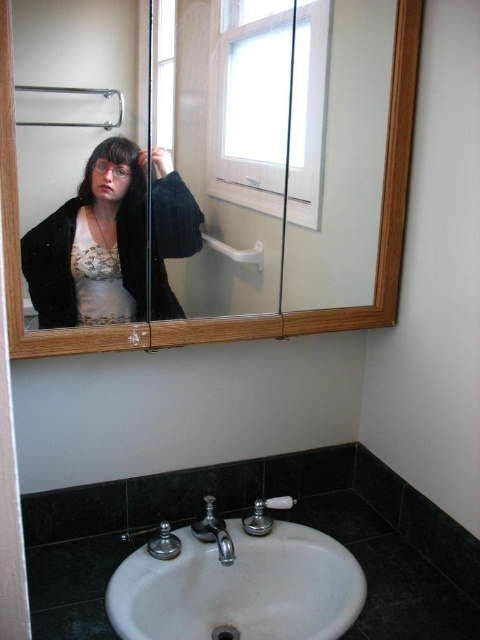
Question: Does white glossy sink at lower center have a greater width compared to silver metallic faucet at lower center?

Choices:
 (A) yes
 (B) no

Answer: (A)

Question: Is white glossy sink at lower center wider than satin nickel faucet at sink center?

Choices:
 (A) no
 (B) yes

Answer: (B)

Question: Which point is closer to the camera taking this photo?

Choices:
 (A) (132, 260)
 (B) (215, 570)

Answer: (A)

Question: Which object is positioned closest to the matte black sweater at upper left?

Choices:
 (A) wooden cabinet at upper center
 (B) satin nickel faucet at sink center
 (C) white glossy sink at lower center
 (D) silver metallic faucet at lower center

Answer: (A)

Question: Which object appears farthest from the camera in this image?

Choices:
 (A) matte black sweater at upper left
 (B) satin nickel faucet at sink center

Answer: (B)

Question: Does matte black sweater at upper left appear over silver metallic faucet at lower center?

Choices:
 (A) yes
 (B) no

Answer: (A)